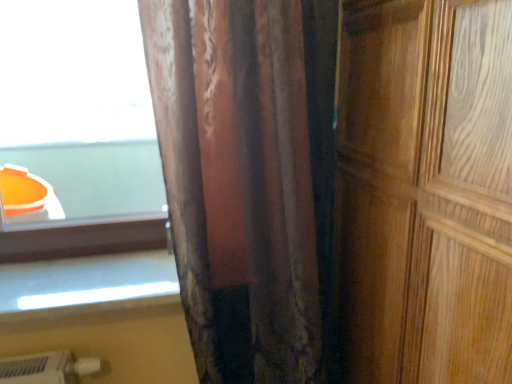
Question: Does velvet-like brown curtain at center have a smaller size compared to wooden door at right?

Choices:
 (A) no
 (B) yes

Answer: (B)

Question: Is velvet-like brown curtain at center further to camera compared to wooden door at right?

Choices:
 (A) yes
 (B) no

Answer: (A)

Question: From the image's perspective, is velvet-like brown curtain at center on wooden door at right?

Choices:
 (A) no
 (B) yes

Answer: (B)

Question: From the image's perspective, is velvet-like brown curtain at center located beneath wooden door at right?

Choices:
 (A) yes
 (B) no

Answer: (B)

Question: Considering the relative sizes of velvet-like brown curtain at center and wooden door at right in the image provided, is velvet-like brown curtain at center wider than wooden door at right?

Choices:
 (A) yes
 (B) no

Answer: (B)

Question: From a real-world perspective, is velvet-like brown curtain at center beneath wooden door at right?

Choices:
 (A) no
 (B) yes

Answer: (A)

Question: Is velvet-like brown curtain at center taller than white glossy window sill at lower left?

Choices:
 (A) no
 (B) yes

Answer: (B)

Question: Is velvet-like brown curtain at center in front of white glossy window sill at lower left?

Choices:
 (A) no
 (B) yes

Answer: (B)

Question: Is velvet-like brown curtain at center not within white glossy window sill at lower left?

Choices:
 (A) no
 (B) yes

Answer: (B)

Question: Is velvet-like brown curtain at center beside white glossy window sill at lower left?

Choices:
 (A) no
 (B) yes

Answer: (A)

Question: Is velvet-like brown curtain at center thinner than white glossy window sill at lower left?

Choices:
 (A) yes
 (B) no

Answer: (B)

Question: Does velvet-like brown curtain at center have a smaller size compared to white glossy window sill at lower left?

Choices:
 (A) yes
 (B) no

Answer: (B)

Question: Is velvet-like brown curtain at center at the back of wooden door at right?

Choices:
 (A) no
 (B) yes

Answer: (A)